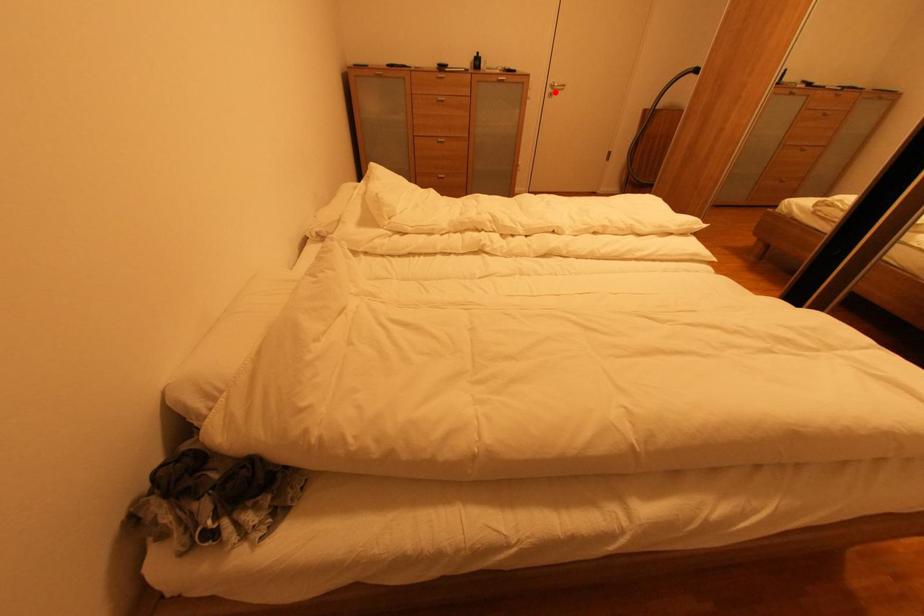
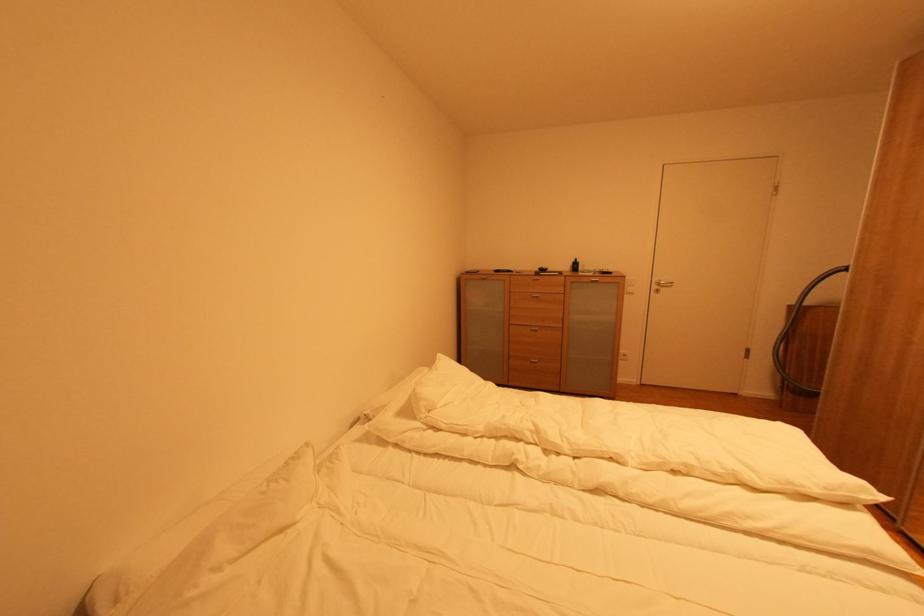
Locate, in the second image, the point that corresponds to the highlighted location in the first image.

(661, 289)